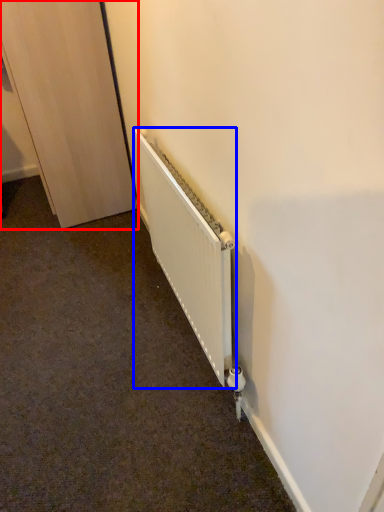
Question: Which object appears farthest to the camera in this image, door (highlighted by a red box) or radiator (highlighted by a blue box)?

Choices:
 (A) door
 (B) radiator

Answer: (A)